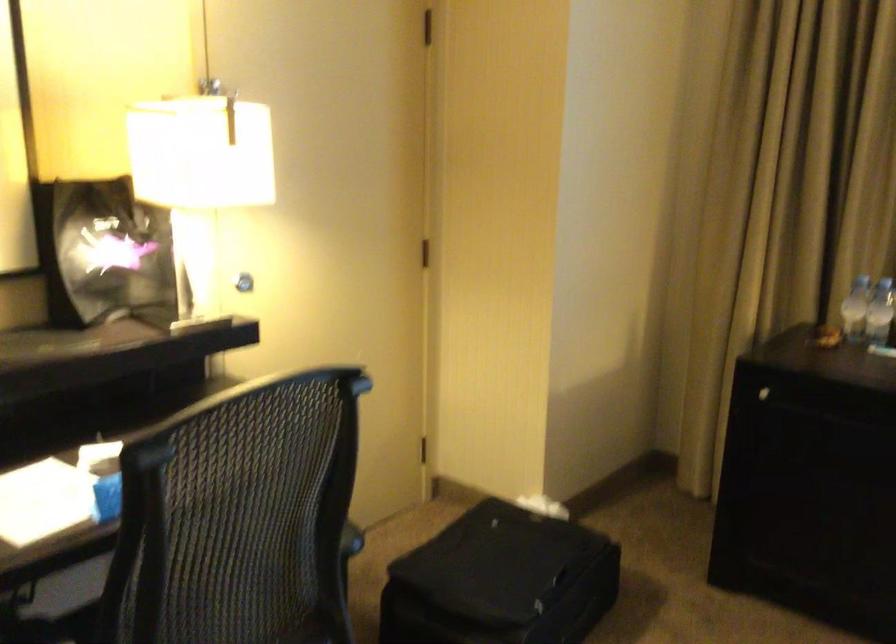
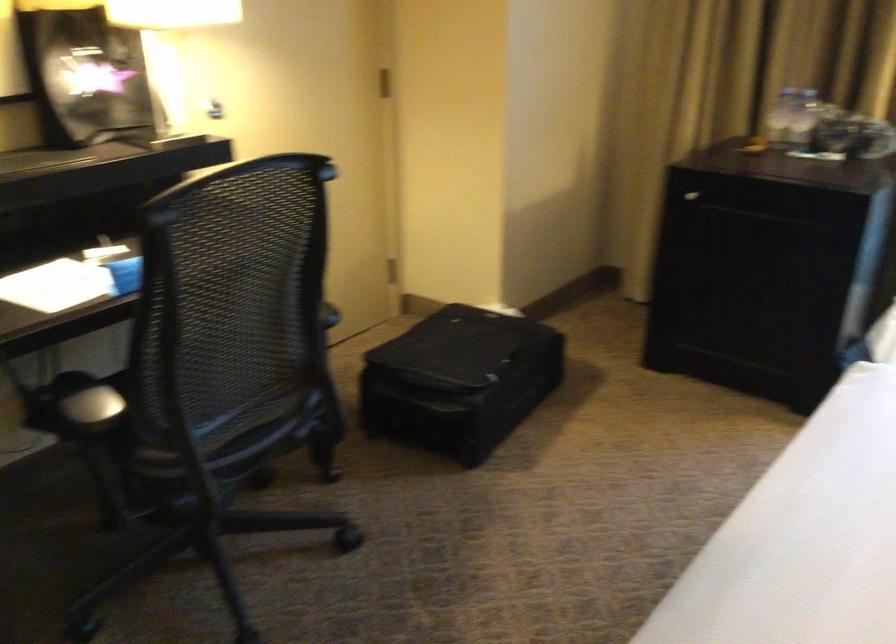
Question: The first image is from the beginning of the video and the second image is from the end. How did the camera likely rotate when shooting the video?

Choices:
 (A) Left
 (B) Right
 (C) Up
 (D) Down

Answer: (D)